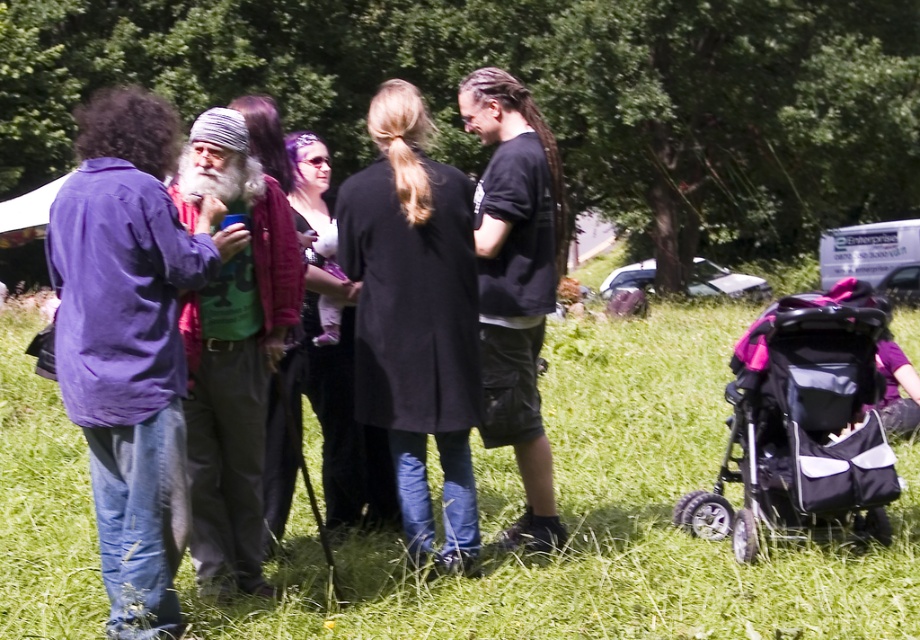
Based on the scene description, where is the purple cotton shirt at left located in terms of its 2D coordinates?

The purple cotton shirt at left is located at the coordinates point (130, 340).

You are planning to set up a small picnic blanket in the grassy area. Considering the green grass at center and the purple cotton shirt at left, which area has a wider space for placing the blanket?

The green grass at center has a wider space than the purple cotton shirt at left, so the picnic blanket should be placed there.

You are a photographer trying to capture a group photo of the purple cotton shirt at left and the pink fabric stroller at lower right. Based on their positions, which object is positioned to the left side of the image?

The purple cotton shirt at left is positioned to the left side of the image.